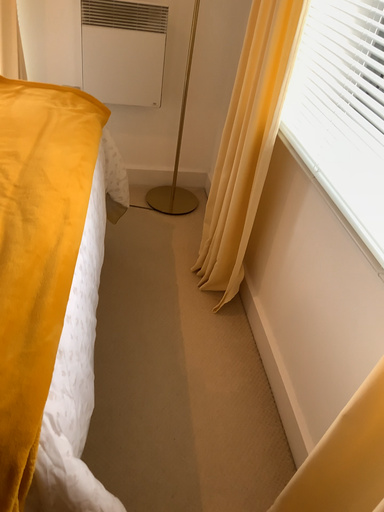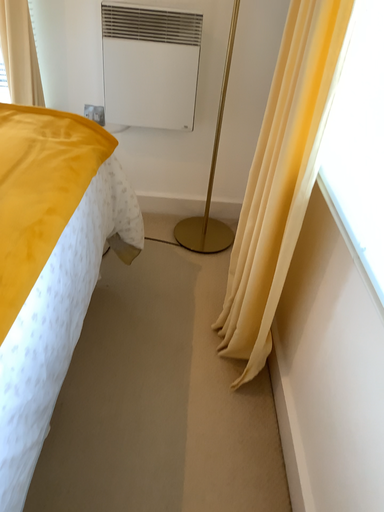
Question: How did the camera likely rotate when shooting the video?

Choices:
 (A) rotated right
 (B) rotated left

Answer: (B)